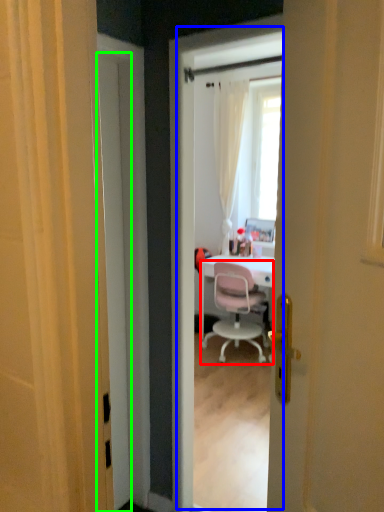
Question: Based on their relative distances, which object is farther from chair (highlighted by a red box)? Choose from screen door (highlighted by a blue box) and door (highlighted by a green box).

Choices:
 (A) screen door
 (B) door

Answer: (B)